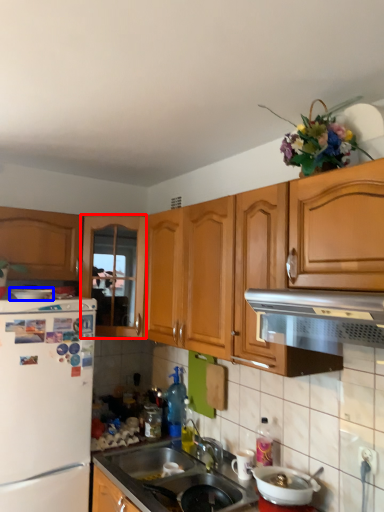
Question: Which of the following is the farthest to the observer, cabinetry (highlighted by a red box) or appliance (highlighted by a blue box)?

Choices:
 (A) cabinetry
 (B) appliance

Answer: (A)